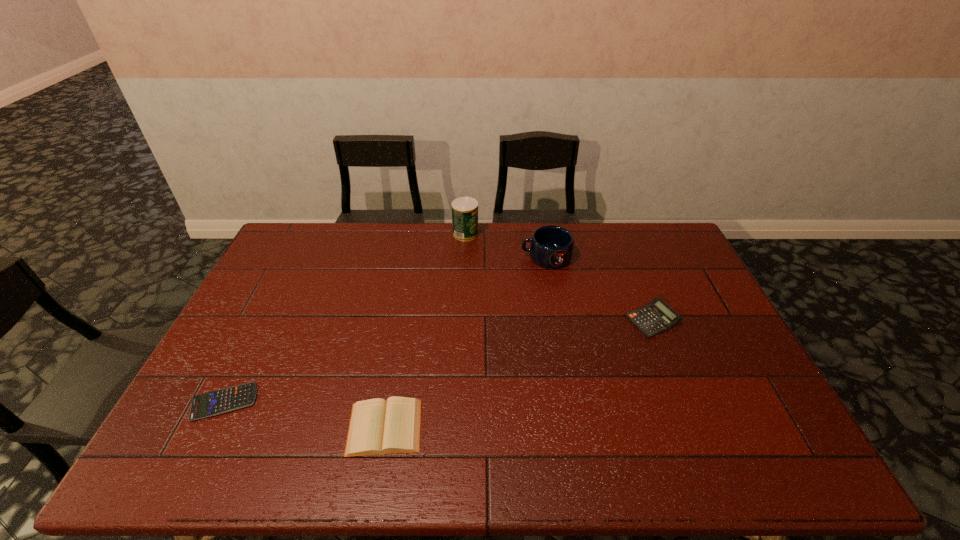
Where is `the tallest object`? the tallest object is located at coordinates (464, 209).

Identify the location of the third object from left to right. (464, 209).

Where is `the fourth nearest object`? This screenshot has width=960, height=540. the fourth nearest object is located at coordinates (551, 246).

The width and height of the screenshot is (960, 540). What are the coordinates of `the fourth shortest object` in the screenshot? It's located at (551, 246).

Locate an element on the screen. the farther calculator is located at coordinates (656, 317).

Identify the location of the third tallest object. This screenshot has height=540, width=960. (656, 317).

At what (x,y) coordinates should I click in order to perform the action: click on the second object from left to right. Please return your answer as a coordinate pair (x, y). This screenshot has width=960, height=540. Looking at the image, I should click on (377, 427).

The image size is (960, 540). I want to click on diary, so click(x=377, y=427).

The image size is (960, 540). What are the coordinates of `the shorter calculator` in the screenshot? It's located at (217, 402).

This screenshot has height=540, width=960. I want to click on the shortest object, so click(217, 402).